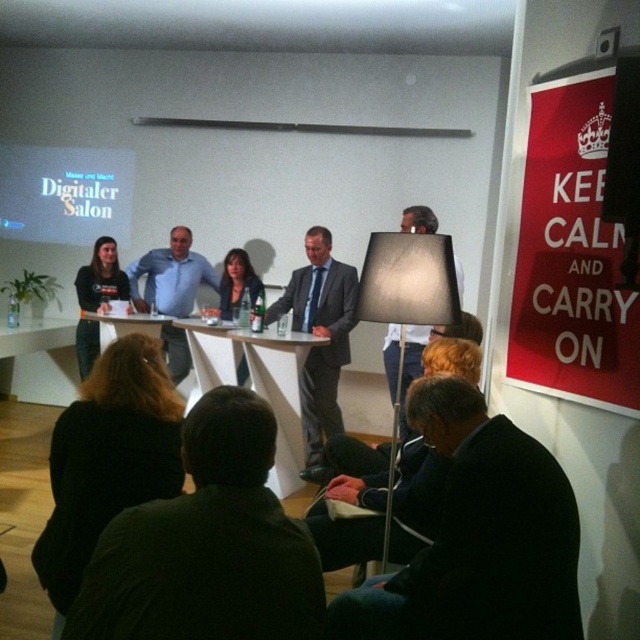
You are an interior designer assessing the lighting in the room. The white matte projection screen at upper left and the white fabric lampshade at center are both white. Which object is shorter?

The white matte projection screen at upper left is shorter than the white fabric lampshade at center.

You are an attendee at the panel discussion and want to take a photo of the white matte projection screen at upper left. From your current position in the audience, which direction should you look to capture the screen in your photo?

The white matte projection screen at upper left is located at point (65, 193), which means it is positioned to the upper left of the image. To capture it in your photo, you should look towards the upper left direction from your current position in the audience.

You are an attendee at the panel discussion. You want to approach the panel to ask a question. There are two points marked in the image. The first point is at coordinate point (92,177) and the second point is at coordinate point (326,490). Which point should you walk towards to get closer to the panel?

You should walk towards point (326,490) because point (92,177) is behind point (326,490), meaning point (326,490) is closer to the panel.